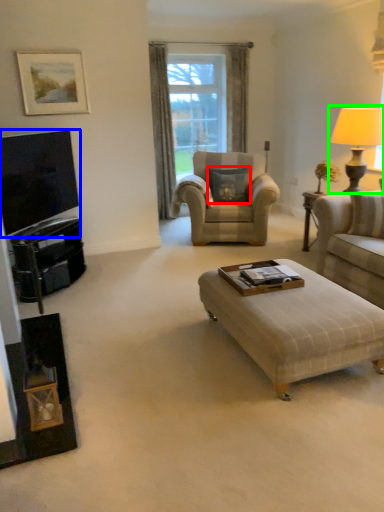
Question: Which is nearer to the pillow (highlighted by a red box)? television (highlighted by a blue box) or table lamp (highlighted by a green box).

Choices:
 (A) television
 (B) table lamp

Answer: (B)